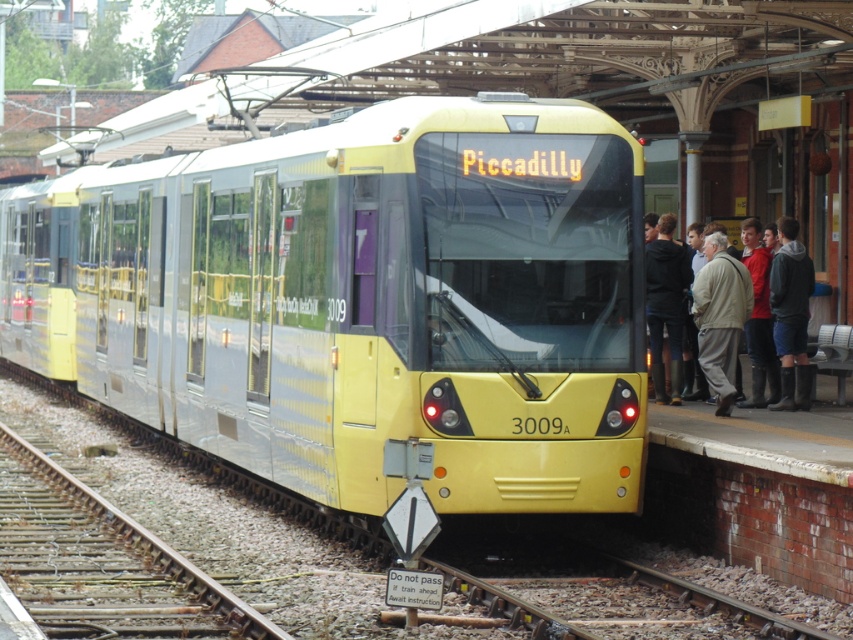
Is yellow metallic train at center positioned at the back of light beige jacket at right?

No, it is not.

Image resolution: width=853 pixels, height=640 pixels. What do you see at coordinates (363, 301) in the screenshot? I see `yellow metallic train at center` at bounding box center [363, 301].

Who is more forward, (440, 285) or (729, 401)?

Positioned in front is point (440, 285).

This screenshot has width=853, height=640. I want to click on yellow metallic train at center, so 363,301.